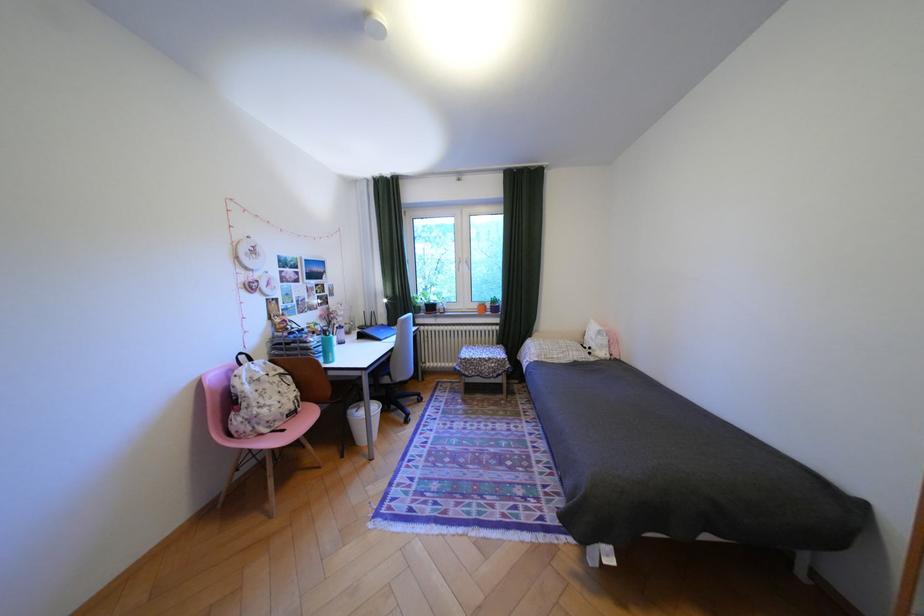
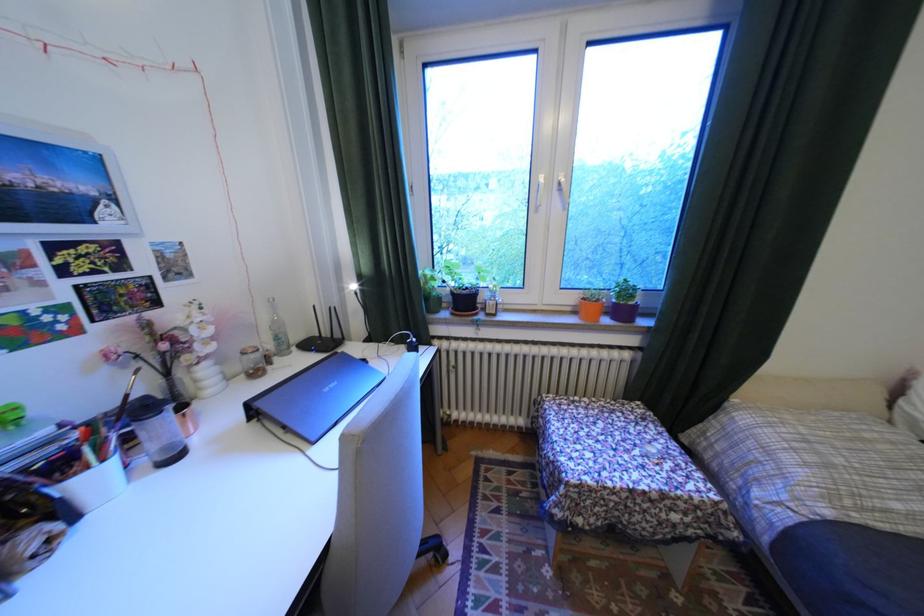
In the second image, find the point that corresponds to (x=432, y=307) in the first image.

(451, 299)